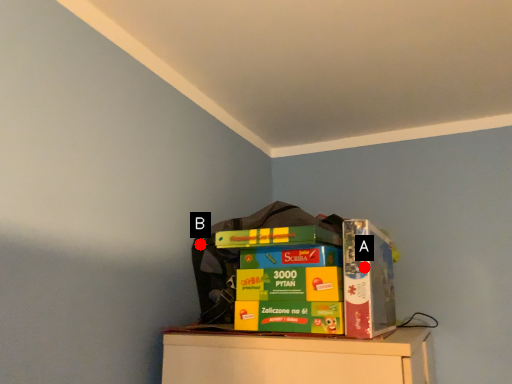
Question: Two points are circled on the image, labeled by A and B beside each circle. Which point is farther to the camera?

Choices:
 (A) A is further
 (B) B is further

Answer: (B)